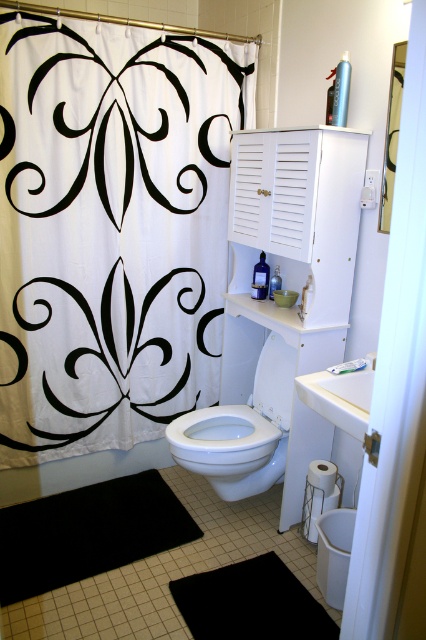
Question: Is black fabric at center to the right of white glossy toilet bowl at center from the viewer's perspective?

Choices:
 (A) no
 (B) yes

Answer: (A)

Question: Can you confirm if white fabric shower curtain at upper left is smaller than white glossy toilet bowl at center?

Choices:
 (A) no
 (B) yes

Answer: (A)

Question: Which object is the closest to the white glossy sink at upper right?

Choices:
 (A) black fabric at center
 (B) black rubber mat at lower left
 (C) white fabric shower curtain at upper left

Answer: (A)

Question: Is white fabric shower curtain at upper left to the left of black rubber mat at lower left from the viewer's perspective?

Choices:
 (A) no
 (B) yes

Answer: (A)

Question: Which of the following is the closest to the observer?

Choices:
 (A) white glossy cabinet at upper center
 (B) white fabric shower curtain at upper left
 (C) white glossy sink at upper right

Answer: (A)

Question: Among these objects, which one is nearest to the camera?

Choices:
 (A) white glossy sink at upper right
 (B) white fabric shower curtain at upper left
 (C) black fabric at center

Answer: (A)